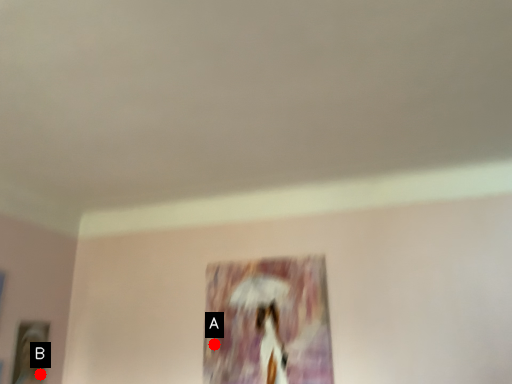
Question: Two points are circled on the image, labeled by A and B beside each circle. Which point appears closest to the camera in this image?

Choices:
 (A) A is closer
 (B) B is closer

Answer: (A)